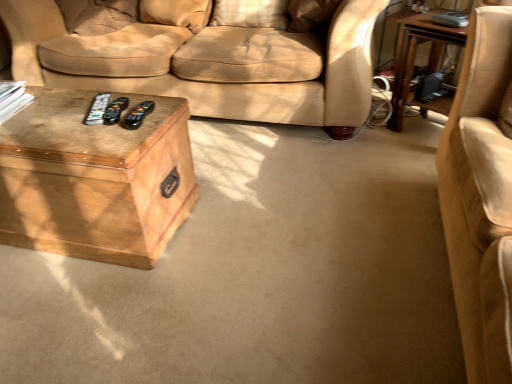
I want to click on unoccupied area in front of black plastic remote at center, the 3th remote in the left-to-right sequence, so click(126, 135).